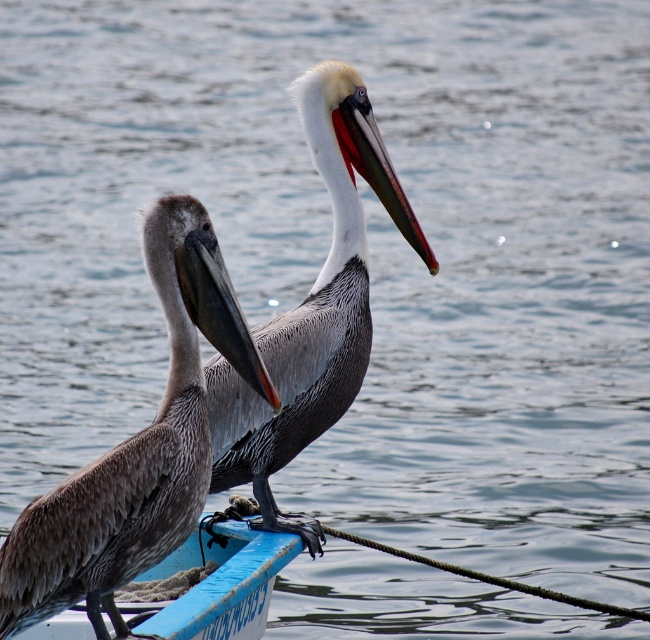
Is point (138, 561) closer to viewer compared to point (195, 547)?

Yes, it is.

Does point (88, 483) come behind point (257, 605)?

No, (88, 483) is closer to viewer.

The width and height of the screenshot is (650, 640). I want to click on brown feathered pelican at center, so click(136, 449).

Is brown speckled pelican at center to the right of blue plastic boat at center from the viewer's perspective?

Indeed, brown speckled pelican at center is positioned on the right side of blue plastic boat at center.

Does brown speckled pelican at center have a larger size compared to blue plastic boat at center?

Yes.

Find the location of a particular element. Image resolution: width=650 pixels, height=640 pixels. brown speckled pelican at center is located at coordinates (313, 308).

Is brown feathered pelican at center bigger than brown speckled pelican at center?

Actually, brown feathered pelican at center might be smaller than brown speckled pelican at center.

Is brown feathered pelican at center taller than brown speckled pelican at center?

No, brown feathered pelican at center is not taller than brown speckled pelican at center.

Which is behind, point (177, 426) or point (304, 348)?

The point (304, 348) is more distant.

Find the location of a particular element. This screenshot has width=650, height=640. brown feathered pelican at center is located at coordinates (136, 449).